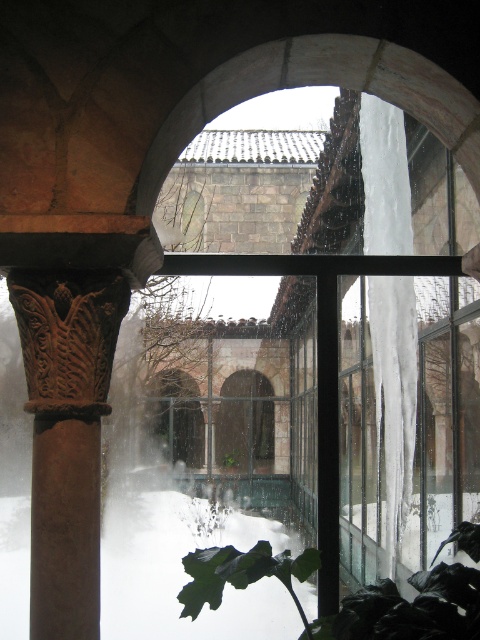
From the picture: Between rusty metal column at left and green leafy plant at center, which one has less height?

With less height is green leafy plant at center.

Is point (60, 524) positioned in front of point (237, 458)?

That is True.

Find the location of a particular element. Image resolution: width=480 pixels, height=640 pixels. rusty metal column at left is located at coordinates click(x=67, y=435).

Based on the photo, between green matte leaf at lower center and green leafy plant at center, which one appears on the left side from the viewer's perspective?

green leafy plant at center is more to the left.

Is green matte leaf at lower center bigger than green leafy plant at center?

Correct, green matte leaf at lower center is larger in size than green leafy plant at center.

Is point (375, 605) farther from viewer compared to point (238, 458)?

That is False.

Where is `green matte leaf at lower center`? The image size is (480, 640). green matte leaf at lower center is located at coordinates (346, 596).

Is white frosted glass at center to the right of green leafy plant at center from the viewer's perspective?

Yes, white frosted glass at center is to the right of green leafy plant at center.

Who is more distant from viewer, (392, 513) or (232, 458)?

Positioned behind is point (392, 513).

Find the location of `white frosted glass at center`. white frosted glass at center is located at coordinates (391, 422).